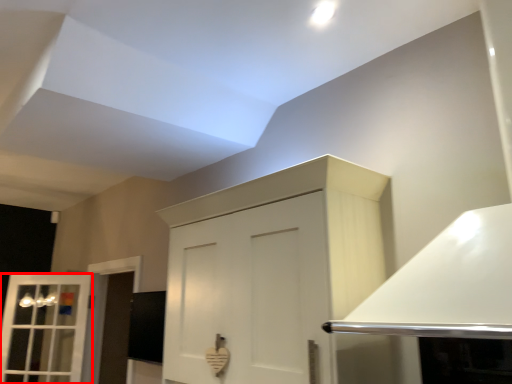
Question: Where is window (annotated by the red box) located in relation to cabinetry in the image?

Choices:
 (A) left
 (B) right

Answer: (A)